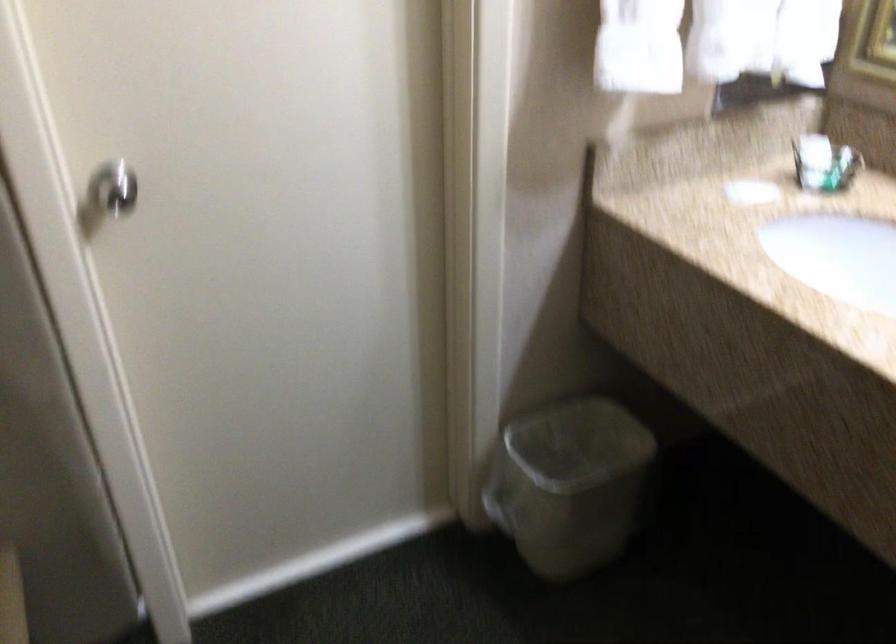
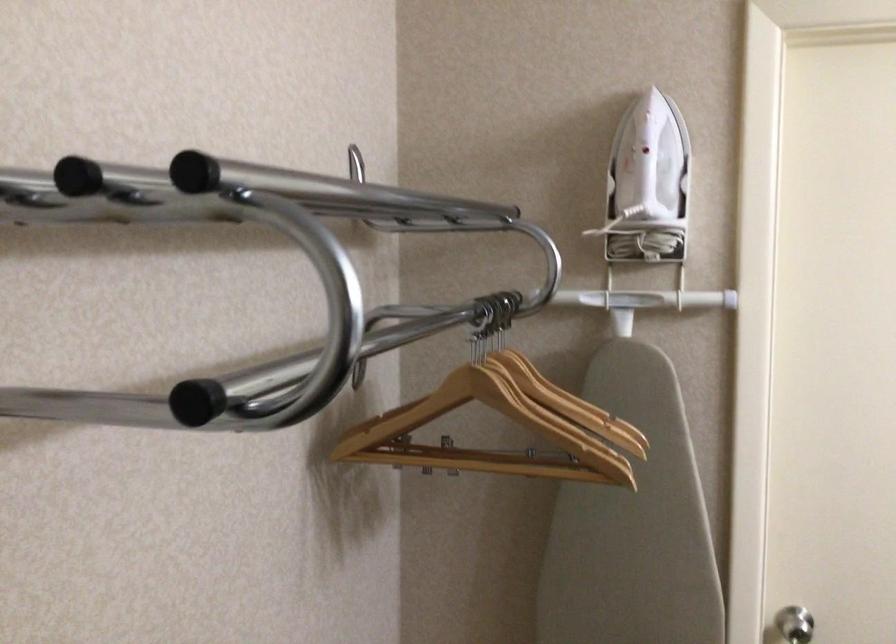
Locate, in the second image, the point that corresponds to the point at 117,202 in the first image.

(794, 625)